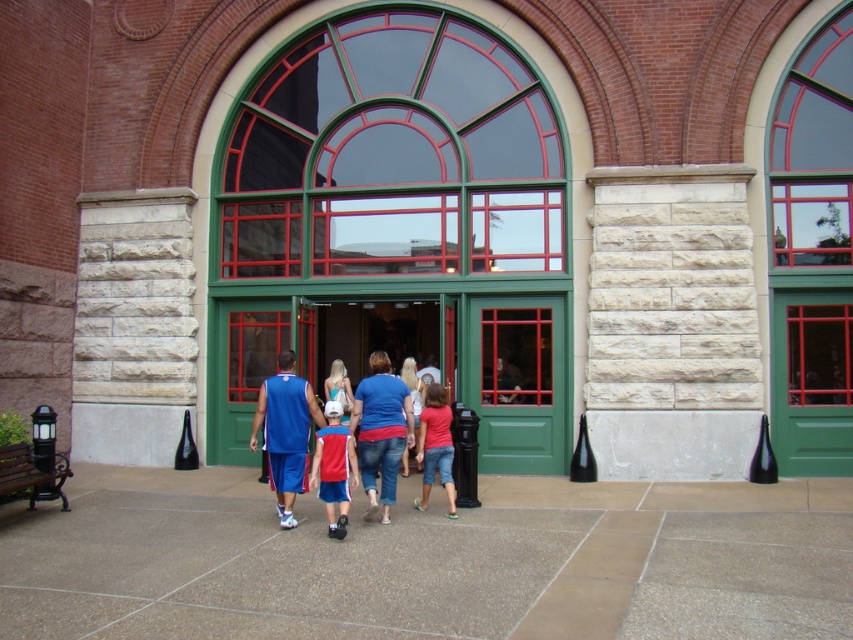
You are a photographer standing in front of the building. You notice two people wearing a blue jersey at center and a red fabric shirt at center. Which clothing item would you need to zoom in more on to capture details if you want both to be equally visible in your photo?

The blue jersey at center has a larger width than the red fabric shirt at center, so you would need to zoom in more on the red fabric shirt at center to make them appear equally visible in the photo.